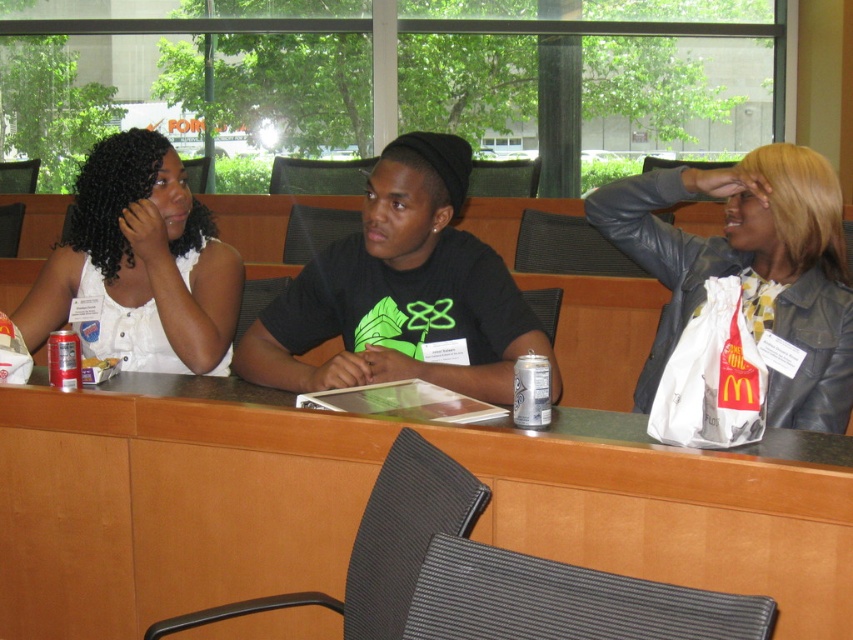
Question: Which object is the farthest from the black matte shirt at center?

Choices:
 (A) green matte table at center
 (B) white matte shirt at upper left

Answer: (B)

Question: Can you confirm if black matte shirt at center is wider than white matte shirt at upper left?

Choices:
 (A) yes
 (B) no

Answer: (A)

Question: Which point appears closest to the camera in this image?

Choices:
 (A) (154, 504)
 (B) (424, 150)

Answer: (A)

Question: Which of the following is the farthest from the observer?

Choices:
 (A) (229, 342)
 (B) (485, 372)
 (C) (755, 468)
 (D) (811, 164)

Answer: (A)

Question: Does green matte table at center have a larger size compared to white matte shirt at upper left?

Choices:
 (A) no
 (B) yes

Answer: (B)

Question: Is black matte shirt at center positioned behind white matte shirt at upper left?

Choices:
 (A) yes
 (B) no

Answer: (B)